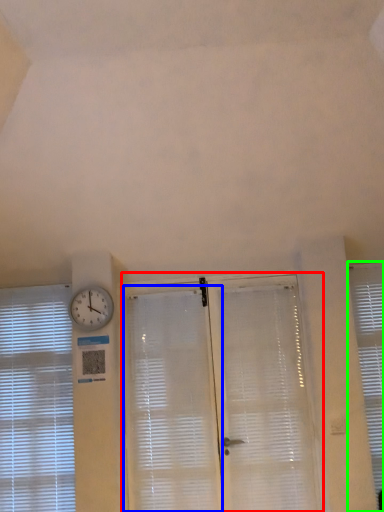
Question: Which object is the closest to the screen door (highlighted by a red box)? Choose among these: shutter (highlighted by a blue box) or window blind (highlighted by a green box).

Choices:
 (A) shutter
 (B) window blind

Answer: (A)